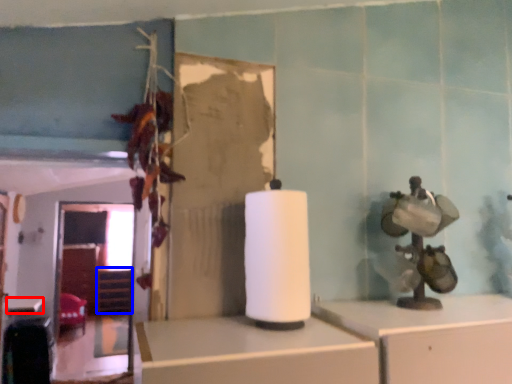
Question: Which object is closer to the camera taking this photo, table (highlighted by a red box) or shelf (highlighted by a blue box)?

Choices:
 (A) table
 (B) shelf

Answer: (A)